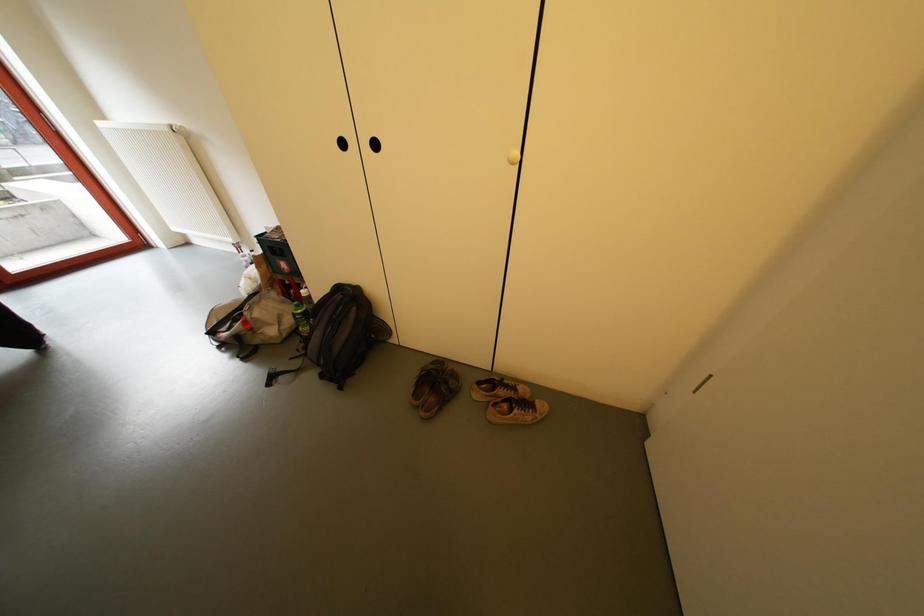
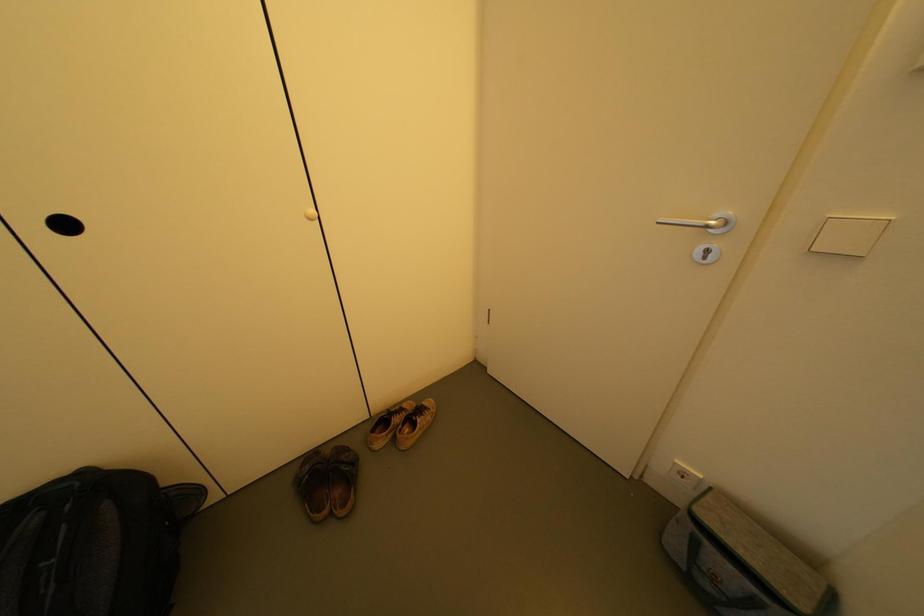
Question: The images are taken continuously from a first-person perspective. In which direction is your viewpoint rotating?

Choices:
 (A) Left
 (B) Right
 (C) Up
 (D) Down

Answer: (B)